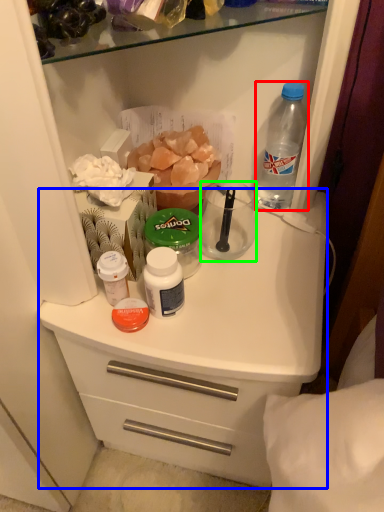
Question: Which is nearer to the bottle (highlighted by a red box)? counter (highlighted by a blue box) or coffee cup (highlighted by a green box).

Choices:
 (A) counter
 (B) coffee cup

Answer: (B)